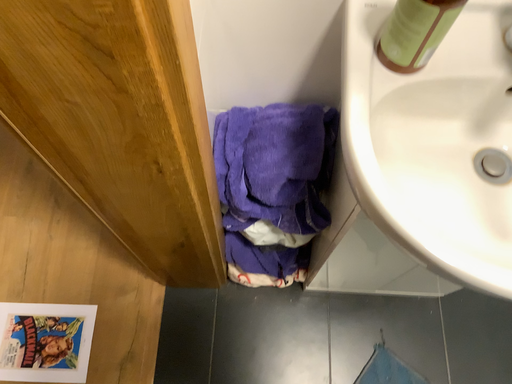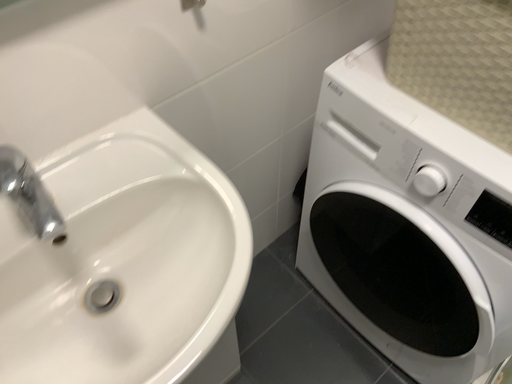
Question: How did the camera likely rotate when shooting the video?

Choices:
 (A) rotated left
 (B) rotated right

Answer: (B)